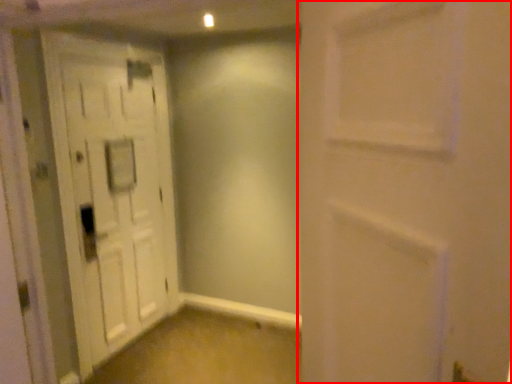
Question: From the image's perspective, what is the correct spatial relationship of door (annotated by the red box) in relation to door?

Choices:
 (A) below
 (B) above

Answer: (A)